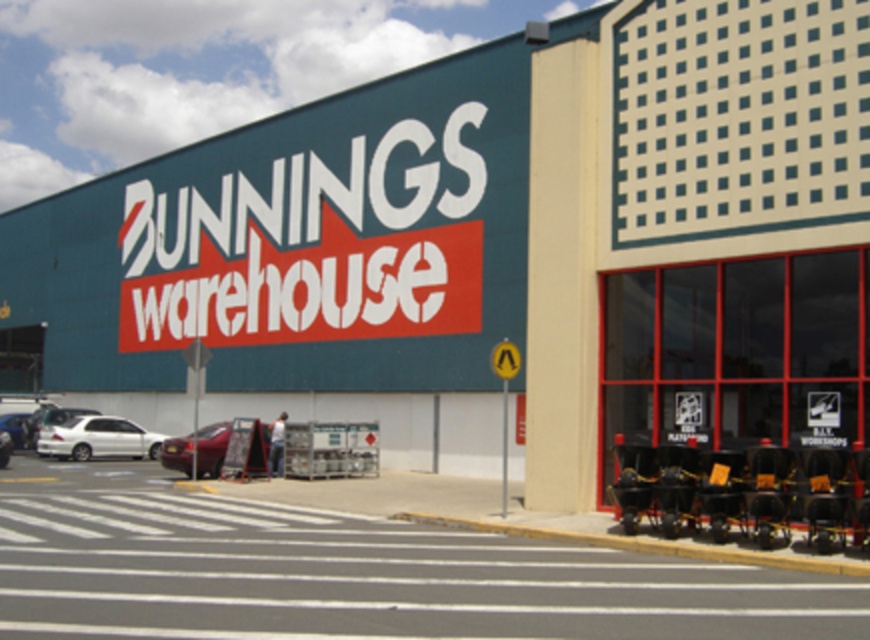
Question: Which of the following is the farthest from the observer?

Choices:
 (A) (57, 449)
 (B) (24, 433)
 (C) (11, 442)
 (D) (183, 436)

Answer: (D)

Question: Can you confirm if metallic red car at center-left is wider than white glossy sedan at center?

Choices:
 (A) no
 (B) yes

Answer: (B)

Question: Based on their relative distances, which object is nearer to the white matte sedan at lower left?

Choices:
 (A) metallic red car at center-left
 (B) white matte sedan at center
 (C) white glossy sedan at center

Answer: (A)

Question: In this image, where is metallic red car at center-left located relative to white glossy sedan at center?

Choices:
 (A) below
 (B) above

Answer: (B)

Question: Which point is closer to the camera?

Choices:
 (A) (87, 458)
 (B) (7, 436)
 (C) (266, 436)
 (D) (17, 426)

Answer: (C)

Question: Considering the relative positions of metallic red car at center-left and white glossy sedan at center in the image provided, where is metallic red car at center-left located with respect to white glossy sedan at center?

Choices:
 (A) above
 (B) below

Answer: (A)